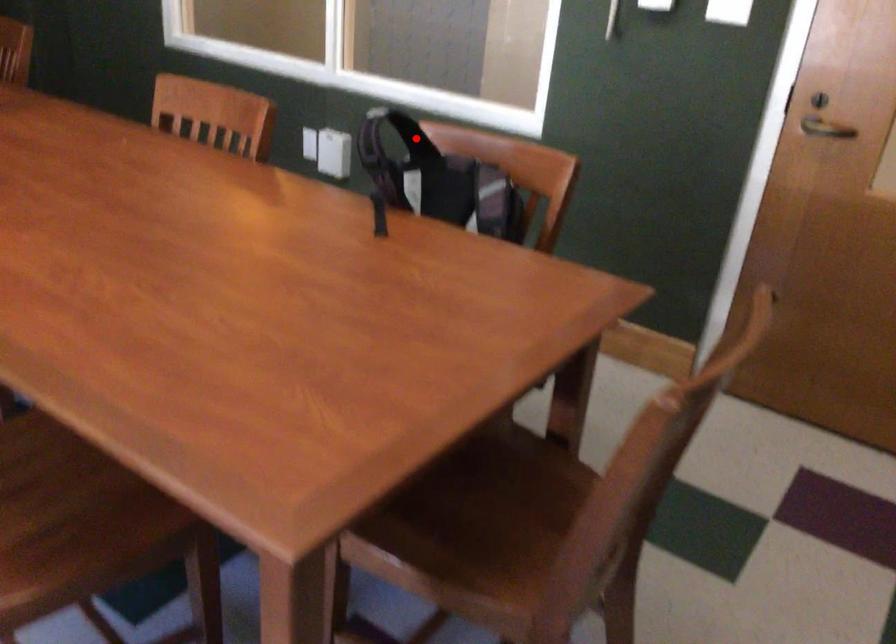
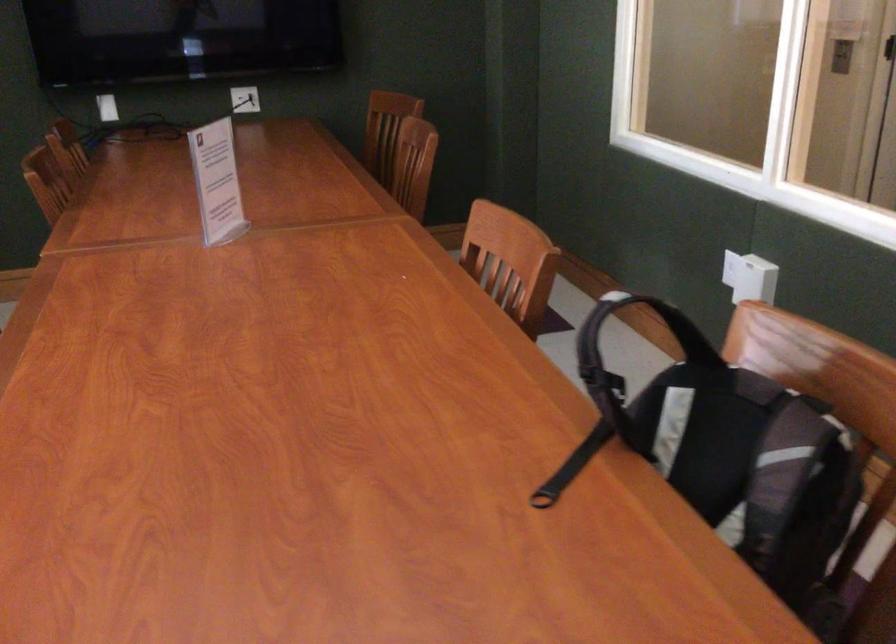
Locate, in the second image, the point that corresponds to the highlighted location in the first image.

(690, 337)